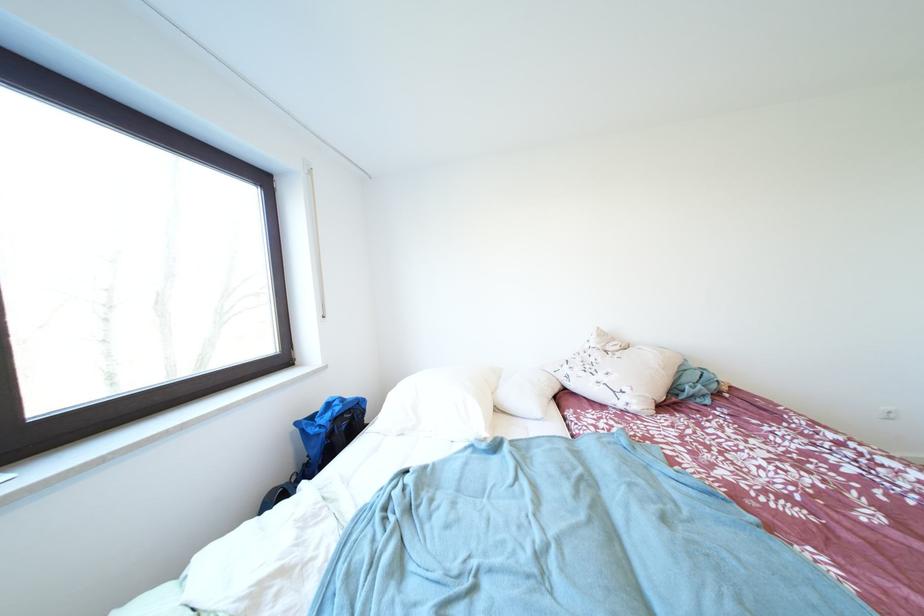
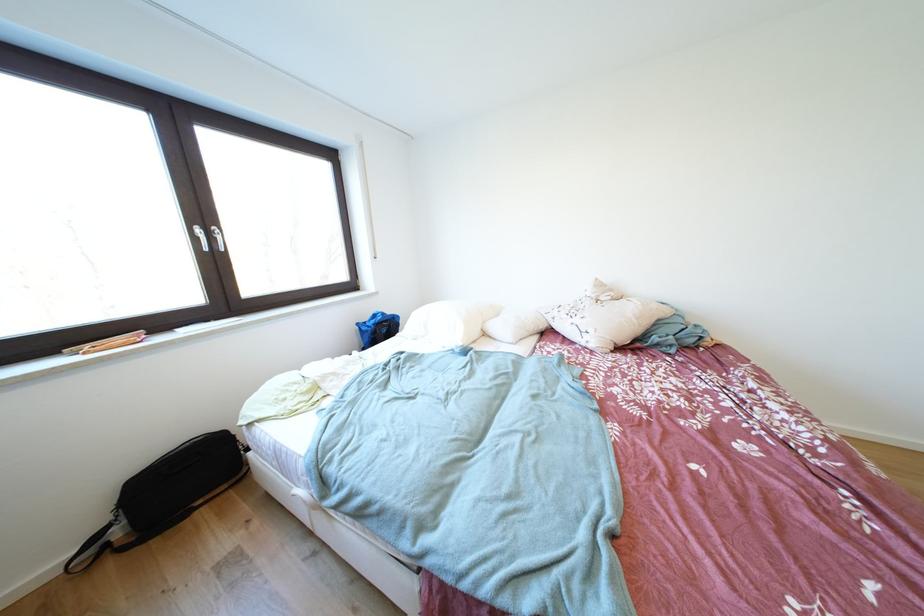
Where in the second image is the point corresponding to (x=372, y=405) from the first image?

(407, 321)